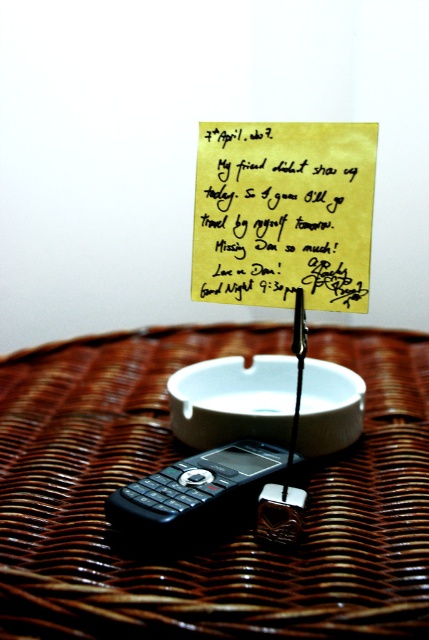
You are organizing items on the woven brown table at center and need to place the yellow paper at center. Considering their heights, which item should be placed on top to ensure stability?

The yellow paper at center should be placed on top of the woven brown table at center because the table has a lesser height, making it stable to place the taller yellow paper on top.

You are organizing items on a wicker surface. You have a yellow paper at center and a black plastic phone at center. Which item takes up more vertical space?

The yellow paper at center is much taller than the black plastic phone at center, so it takes up more vertical space.

You are organizing items on a woven brown table at center and need to place a black plastic phone at center. Considering their sizes, which item should you place first to ensure stability?

The woven brown table at center is bigger than the black plastic phone at center, so you should place the woven brown table at center first to ensure stability.